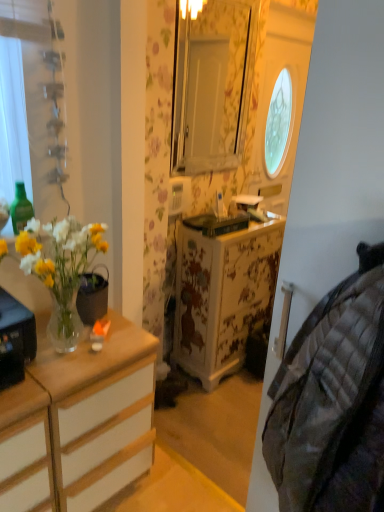
Question: From the image's perspective, is clear glass vase at left located above or below plaid fabric quilt at right?

Choices:
 (A) below
 (B) above

Answer: (B)

Question: Considering the relative positions of clear glass vase at left and plaid fabric quilt at right in the image provided, is clear glass vase at left to the left or to the right of plaid fabric quilt at right?

Choices:
 (A) left
 (B) right

Answer: (A)

Question: Which is farther from the clear glass vase at left?

Choices:
 (A) green glass bottle at left
 (B) white wood dresser at left, the first cabinetry viewed from the right
 (C) wooden cabinet at left, which is the first cabinetry from left to right
 (D) plaid fabric quilt at right

Answer: (D)

Question: Estimate the real-world distances between objects in this image. Which object is closer to the clear glass vase at left?

Choices:
 (A) plaid fabric quilt at right
 (B) green glass bottle at left
 (C) white wood dresser at left, the first cabinetry viewed from the right
 (D) wooden cabinet at left, positioned as the second cabinetry in right-to-left order

Answer: (D)